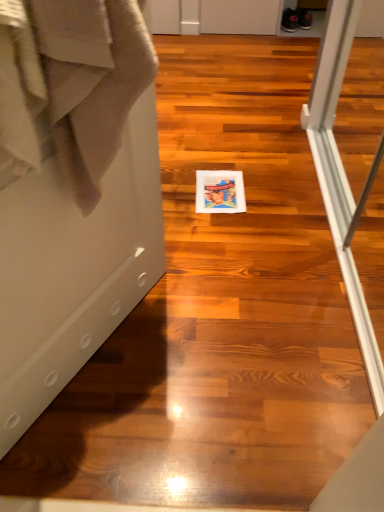
Locate an element on the screen. This screenshot has width=384, height=512. vacant space behind white glossy screen door at center is located at coordinates (178, 262).